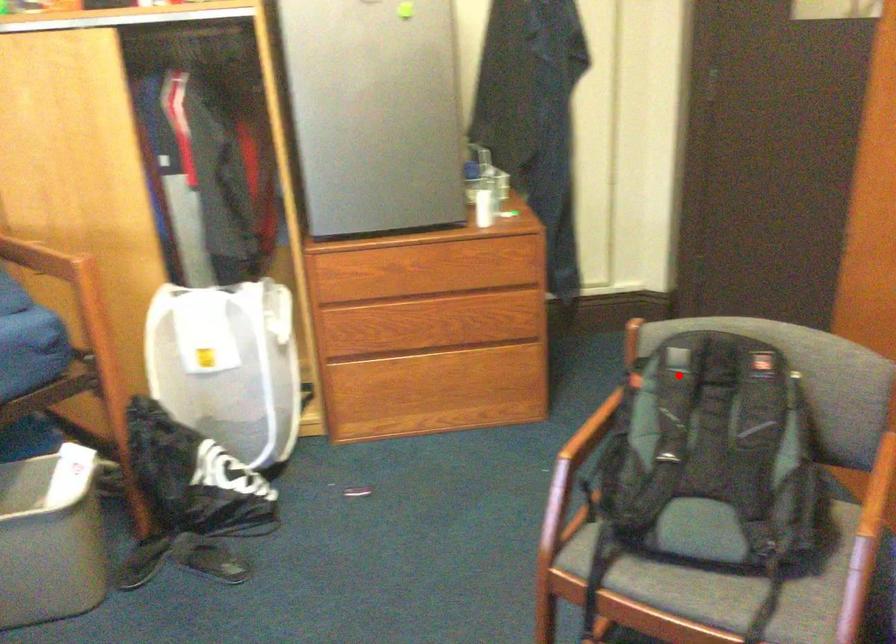
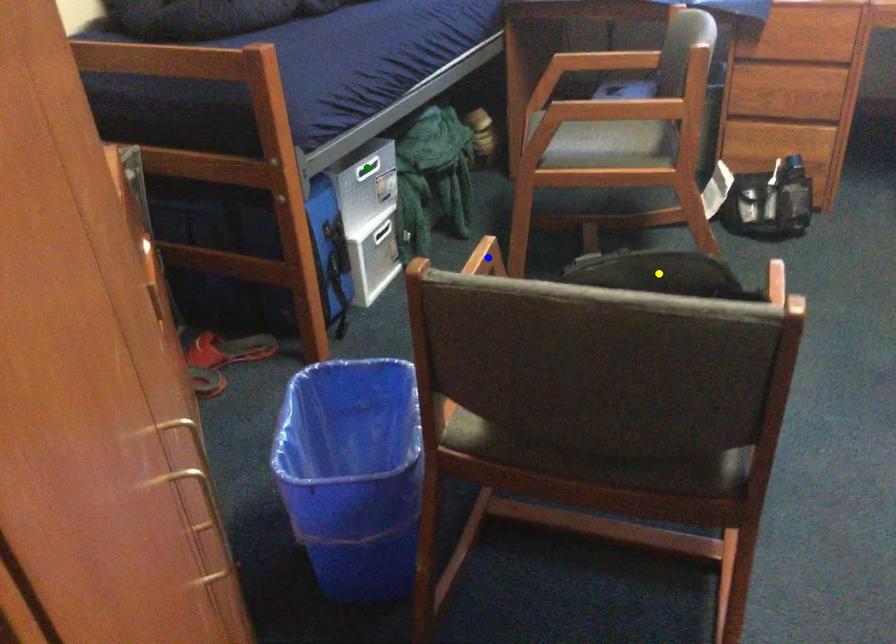
Question: I am providing you with two images of the same scene from different viewpoints. A red point is marked on the first image. You are given multiple points on the second image. Which point in image 2 represents the same 3d spot as the red point in image 1?

Choices:
 (A) green point
 (B) yellow point
 (C) blue point

Answer: (B)